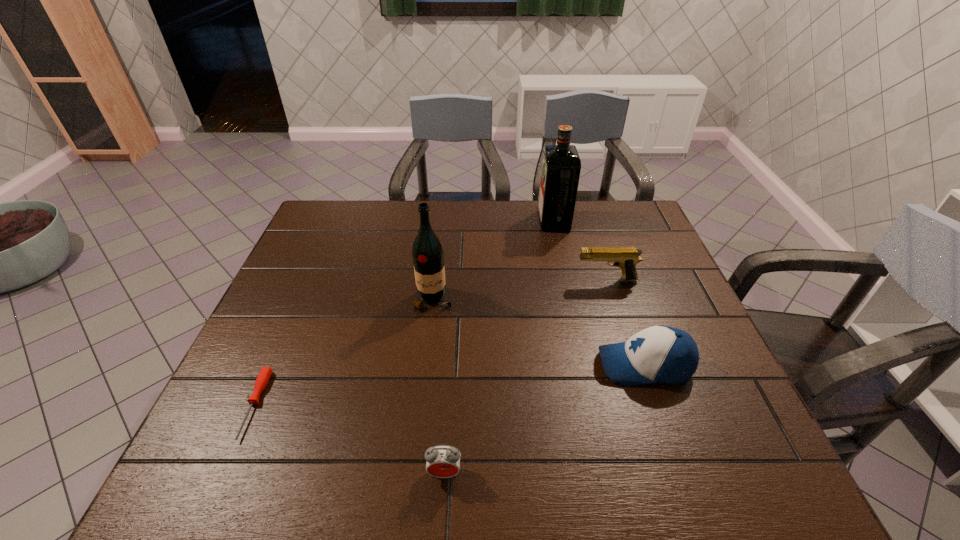
Locate an element on the screen. liquor is located at coordinates (561, 165).

The height and width of the screenshot is (540, 960). I want to click on wine bottle, so click(x=428, y=257).

Identify the location of baseball cap. This screenshot has height=540, width=960. (661, 354).

Identify the location of pistol. click(626, 258).

Locate an element on the screen. alarm clock is located at coordinates (443, 461).

At what (x,y) coordinates should I click in order to perform the action: click on the shortest object. Please return your answer as a coordinate pair (x, y). The width and height of the screenshot is (960, 540). Looking at the image, I should click on (262, 380).

At what (x,y) coordinates should I click in order to perform the action: click on screwdriver. Please return your answer as a coordinate pair (x, y). Image resolution: width=960 pixels, height=540 pixels. Looking at the image, I should click on (262, 380).

Identify the location of free location located 0.340m on the front label of the liquor. (439, 221).

The width and height of the screenshot is (960, 540). I want to click on free space located 0.100m on the front label of the liquor, so click(x=510, y=221).

Identify the location of vacant space located on the front label of the liquor. (518, 221).